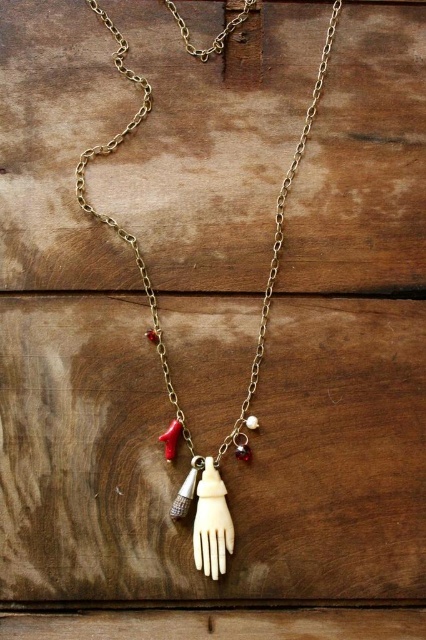
You are examining the necklace from above. There are two points on the necklace at coordinates point (x=164, y=353) and point (x=195, y=460). Which point is closer to you?

Point (x=164, y=353) is further to the viewer than point (x=195, y=460), so point (x=164, y=353) is closer to you.

What object is located at the coordinates point (250, 372) on the image?

The point (250, 372) marks the bone or carved hand at the center of the necklace.